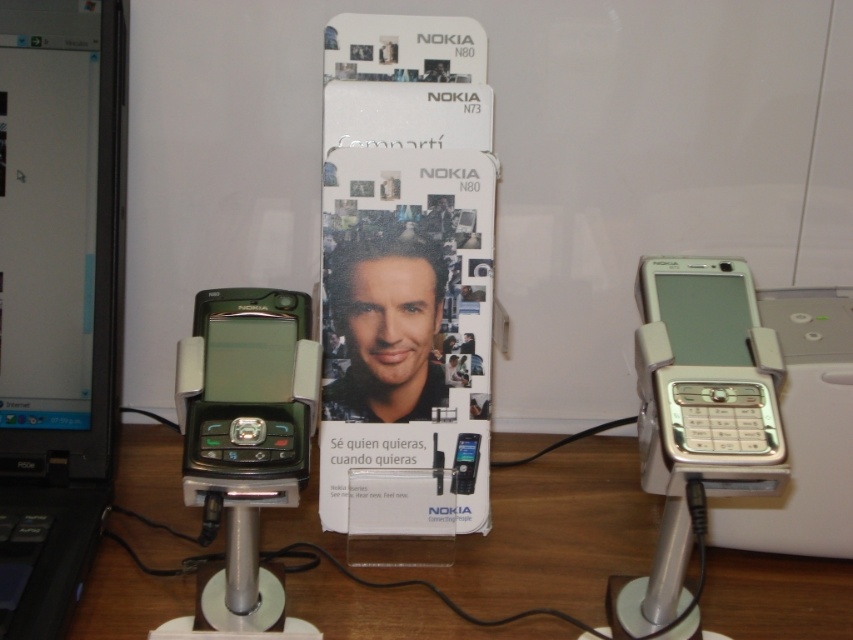
Question: Which object appears closest to the camera in this image?

Choices:
 (A) wooden table at center
 (B) silver metallic phone at right

Answer: (B)

Question: Which of the following is the farthest from the observer?

Choices:
 (A) black plastic laptop at left
 (B) silver metallic phone at right
 (C) matte black phone at center

Answer: (C)

Question: Is the position of wooden table at center more distant than that of matte black phone at center?

Choices:
 (A) yes
 (B) no

Answer: (B)

Question: Is black plastic laptop at left closer to the viewer compared to silver metallic phone at right?

Choices:
 (A) no
 (B) yes

Answer: (A)

Question: Is wooden table at center positioned behind black plastic laptop at left?

Choices:
 (A) no
 (B) yes

Answer: (B)

Question: Which point is closer to the camera?

Choices:
 (A) (688, 264)
 (B) (489, 598)
 (C) (119, 115)

Answer: (A)